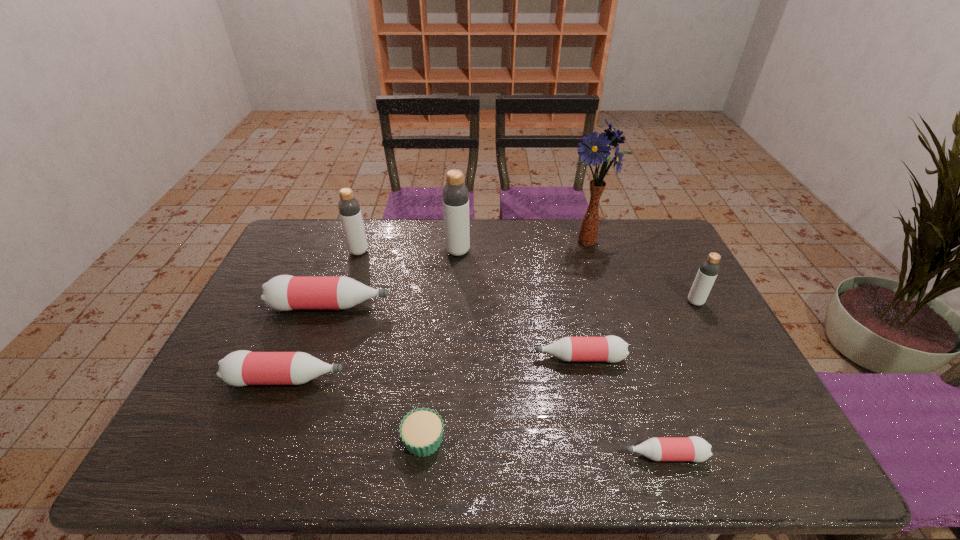
I want to click on free point between the shortest bottle and the sixth tallest object, so click(x=475, y=417).

Where is `vacant area that lies between the biggest gray bottle and the rightmost object`? The width and height of the screenshot is (960, 540). vacant area that lies between the biggest gray bottle and the rightmost object is located at coordinates (577, 276).

This screenshot has width=960, height=540. What are the coordinates of `empty space between the biggest pink bottle and the seventh tallest object` in the screenshot? It's located at (455, 332).

You are a GUI agent. You are given a task and a screenshot of the screen. Output one action in this format:
    pyautogui.click(x=<x>, y=<y>)
    Task: Click on the empty space that is in between the second tallest object and the rightmost bottle
    This screenshot has height=540, width=960.
    Given the screenshot: What is the action you would take?
    pyautogui.click(x=577, y=276)

This screenshot has width=960, height=540. I want to click on free spot between the third shortest object and the sixth shortest bottle, so click(469, 305).

Find the location of a particular element. The height and width of the screenshot is (540, 960). free spot between the third biggest pink bottle and the biggest pink bottle is located at coordinates (455, 332).

The height and width of the screenshot is (540, 960). I want to click on vacant space that is in between the leftmost gray bottle and the fourth shortest object, so click(x=323, y=315).

Identify the location of free space between the cupcake and the nearest bottle. 544,447.

Find the location of a particular element. The height and width of the screenshot is (540, 960). unoccupied position between the nearest bottle and the seventh shortest object is located at coordinates (512, 353).

Locate an element on the screen. The width and height of the screenshot is (960, 540). vacant space that is in between the fourth shortest object and the purple flower arrangement is located at coordinates (438, 310).